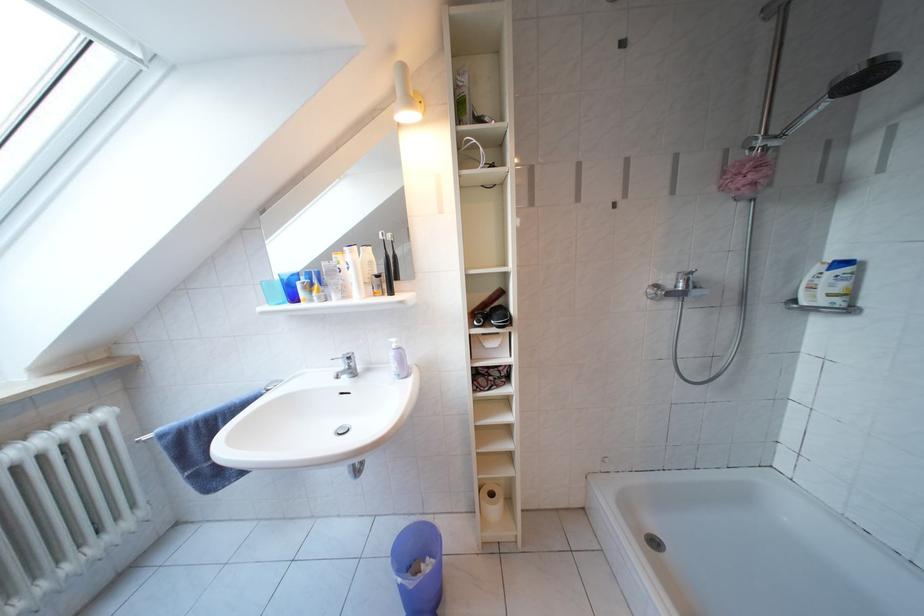
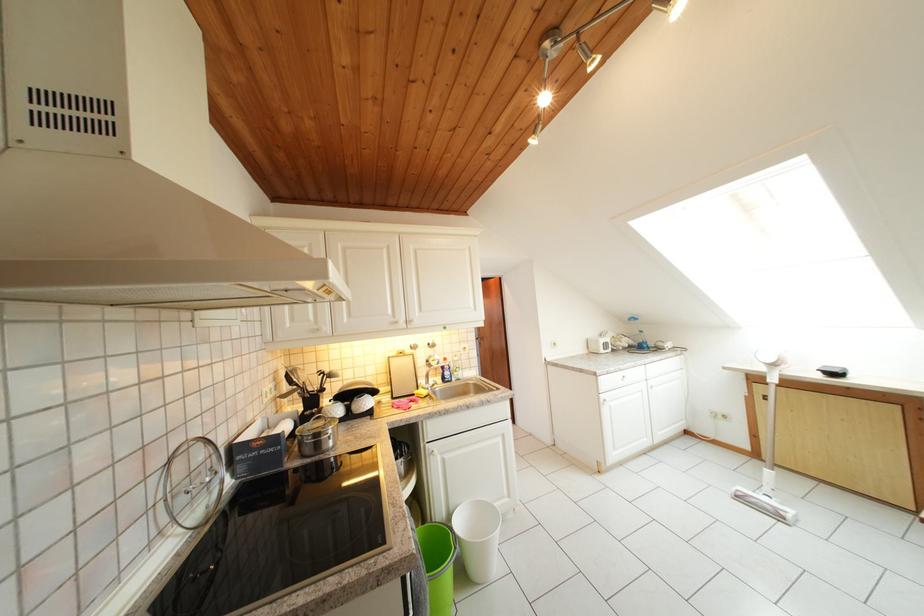
Question: I am providing you with two images of the same scene from different viewpoints. After the viewpoint changes to image2, which objects are now occluded?

Choices:
 (A) silver cabinet knob
 (B) small white bucket
 (C) dish soap bottle
 (D) black toothbrush

Answer: (D)